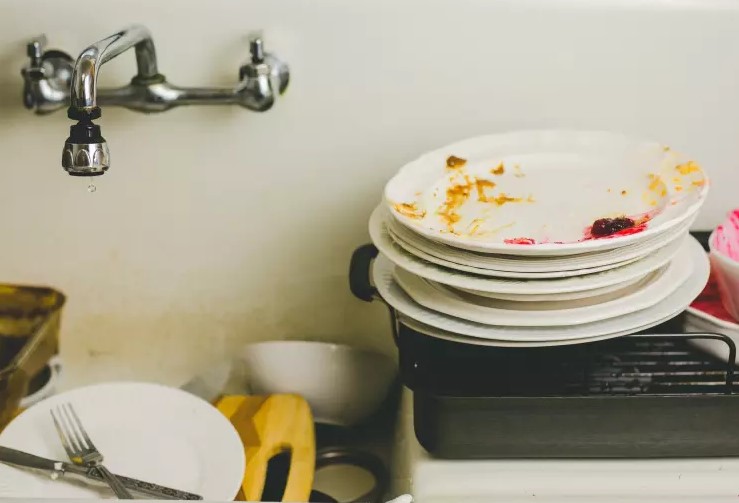
The height and width of the screenshot is (503, 739). I want to click on plate, so click(460, 338), click(483, 336), click(500, 318), click(530, 298), click(505, 287), click(517, 274), click(531, 264), click(562, 234), click(188, 442).